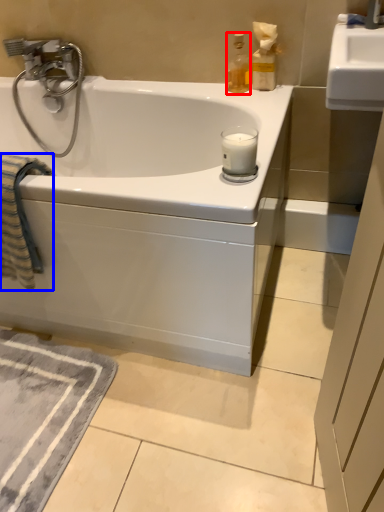
Question: Which point is closer to the camera, bottle (highlighted by a red box) or beach towel (highlighted by a blue box)?

Choices:
 (A) bottle
 (B) beach towel

Answer: (B)